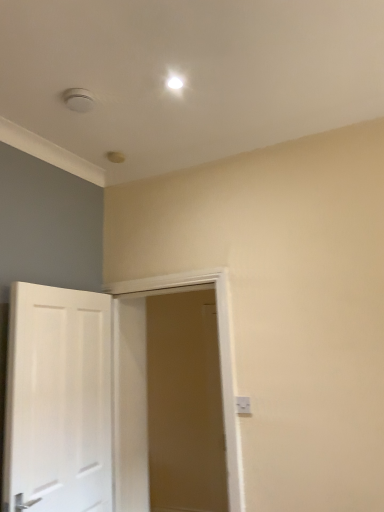
Question: Relative to white glossy door at left, the 2th door viewed from the right, is white plastic electric outlet at lower right in front or behind?

Choices:
 (A) front
 (B) behind

Answer: (B)

Question: Is white plastic electric outlet at lower right taller or shorter than white glossy door at left, arranged as the first door when viewed from the left?

Choices:
 (A) tall
 (B) short

Answer: (B)

Question: Estimate the real-world distances between objects in this image. Which object is farther from the white wooden door at center, which is the first door in right-to-left order?

Choices:
 (A) white plastic electric outlet at lower right
 (B) white glossy door at left, arranged as the first door when viewed from the left

Answer: (A)

Question: Considering the real-world distances, which object is farthest from the white plastic electric outlet at lower right?

Choices:
 (A) white wooden door at center, which is the first door in right-to-left order
 (B) white glossy door at left, the 2th door viewed from the right

Answer: (A)